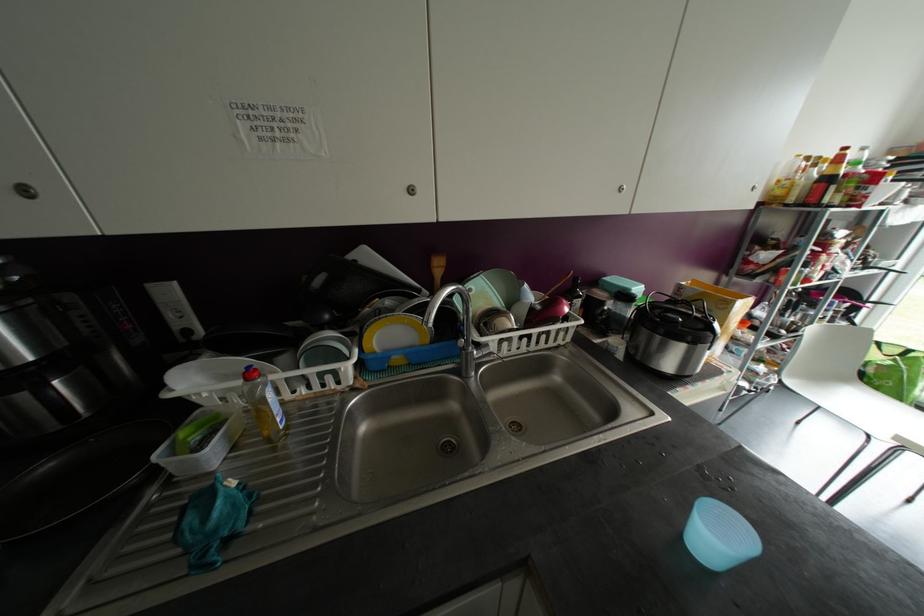
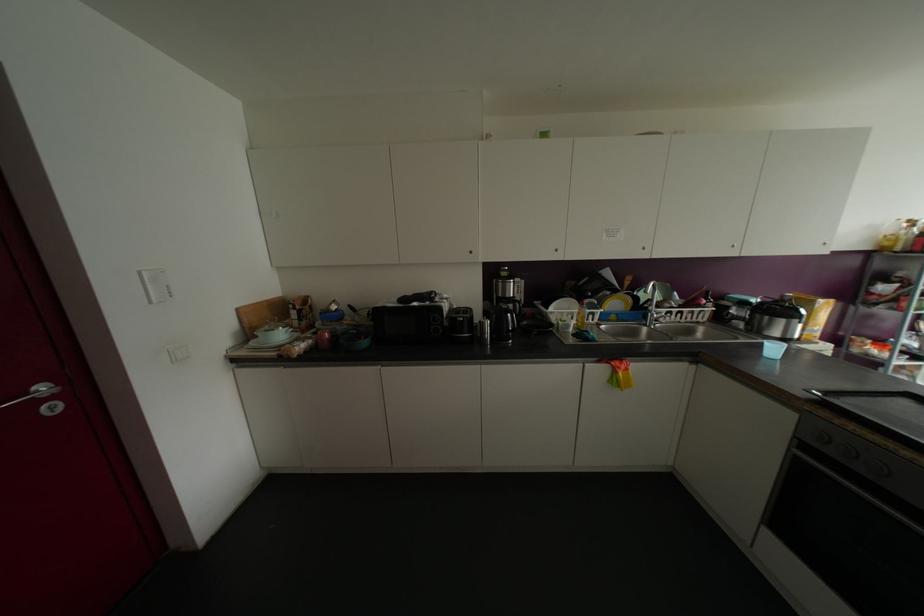
The point at (524,347) is marked in the first image. Where is the corresponding point in the second image?

(677, 318)